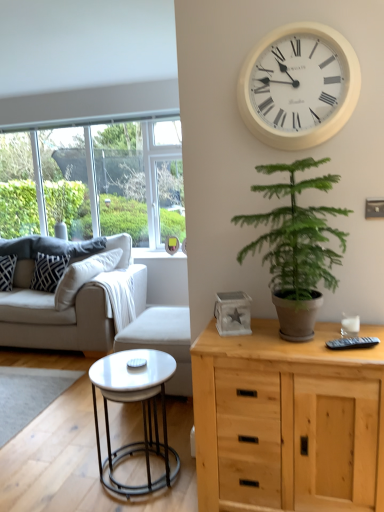
This screenshot has height=512, width=384. Find the location of `free space to the back side of white glossy coffee table at lower left`. free space to the back side of white glossy coffee table at lower left is located at coordinates (147, 428).